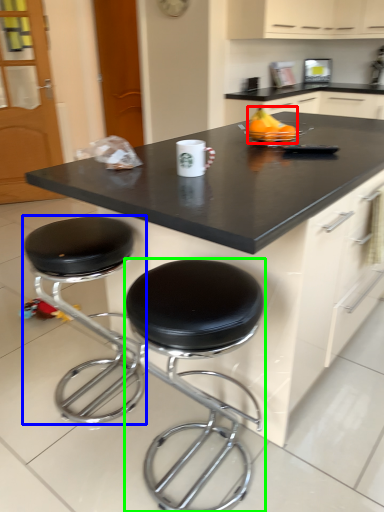
Question: Which is farther away from fruit (highlighted by a red box)? stool (highlighted by a blue box) or stool (highlighted by a green box)?

Choices:
 (A) stool
 (B) stool

Answer: (A)